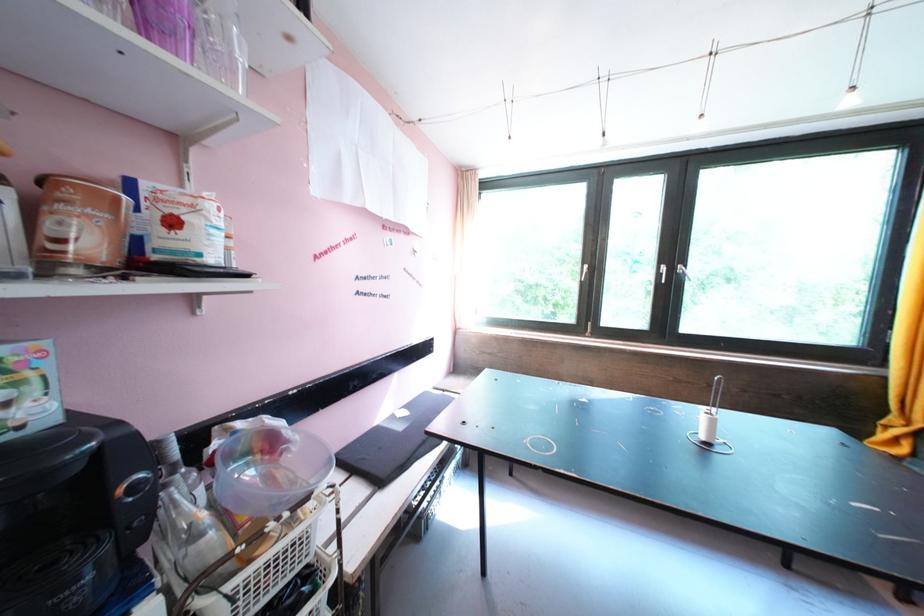
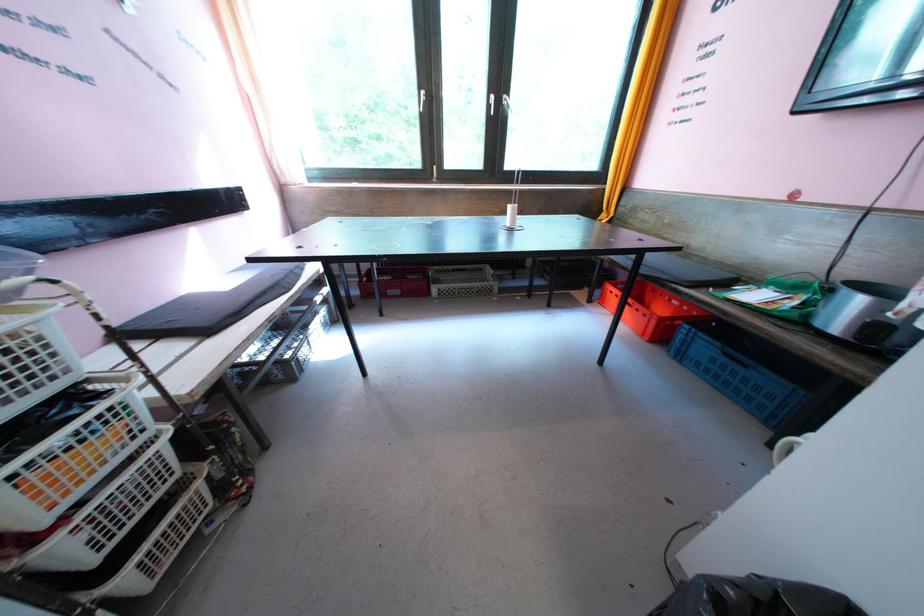
Where in the second image is the point corresponding to the point at 301,546 from the first image?

(15, 354)